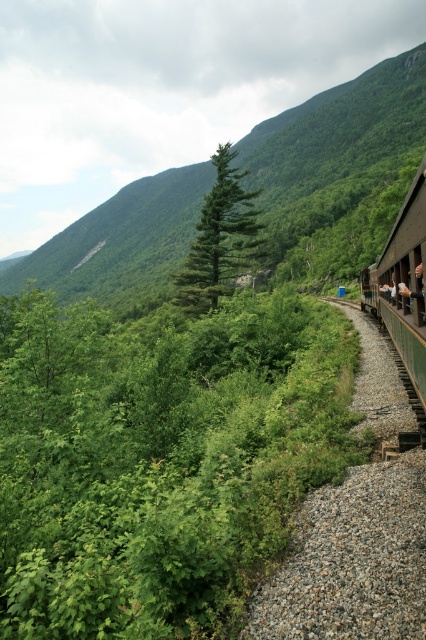
You are standing at the center of the image and want to locate the green leafy hillside at upper left. Which direction should you look to find it?

You should look towards the upper left direction to find the green leafy hillside at upper left, as it is located at point coordinates of (337,131).

You are a hiker planning to take a photo of the green leafy hillside at upper left and the green matte tree at center from the gravel path. Which object will appear taller in your photo?

The green leafy hillside at upper left will appear taller in the photo because it has a greater height compared to the green matte tree at center.

You are a photographer planning to take a photo of the green wooden train at right and the green leafy shrubs at center. Which object should you focus on first if you want to capture both in a single shot without moving the camera?

The green leafy shrubs at center are wider than the green wooden train at right, so you should focus on the green leafy shrubs at center first to ensure they fit within the frame.